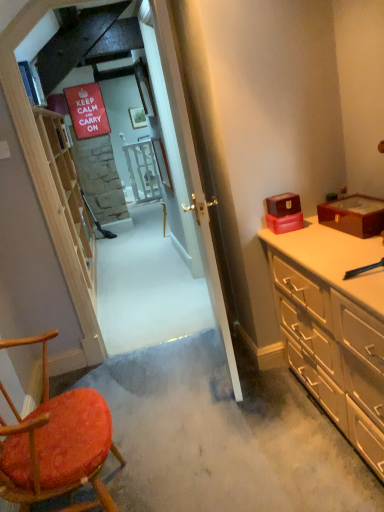
This screenshot has height=512, width=384. What are the coordinates of `vacant space in front of matte red box at right, the second box in the right-to-left sequence` in the screenshot? It's located at (301, 238).